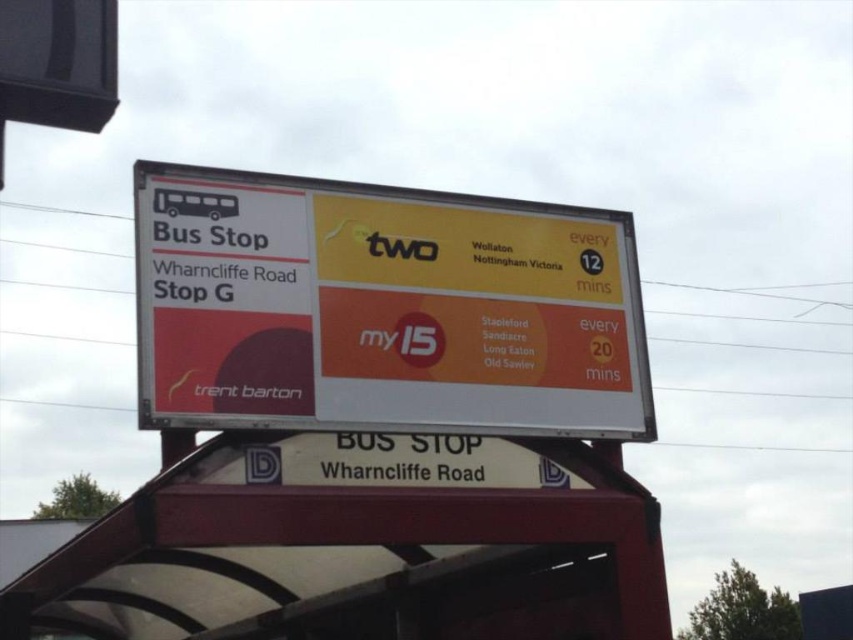
You are standing at the bus stop and need to find the white plastic signboard at upper center. According to the scene description, where should you look relative to the advertisements on the right side of the signboard?

The white plastic signboard at upper center is located at point (381, 308), which is near the center of the signboard. Since the advertisements are on the right side, the signboard is to the left of the advertisements.

You are a pedestrian trying to read the bus schedule at the bus stop. You see the white plastic signboard at upper center and the white plastic bus stop at center. Which object should you look at to find the schedule information?

The white plastic signboard at upper center is positioned on the right side of the white plastic bus stop at center. Therefore, you should look at the white plastic signboard at upper center to find the schedule information as it likely contains the bus schedule details.

You are a bus driver approaching Wharncliffe Road Stop G. You need to check the signboard to ensure you are at the correct stop. Which object should you look at first, the white plastic signboard at upper center or the white plastic bus stop at center?

The white plastic signboard at upper center is thinner than the white plastic bus stop at center, so you should look at the white plastic bus stop at center first since it is wider and more prominent.